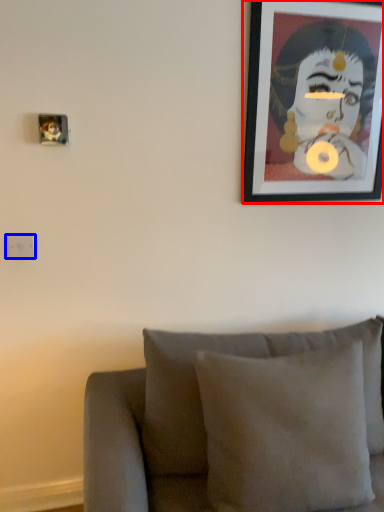
Question: Which point is further to the camera, picture frame (highlighted by a red box) or electric outlet (highlighted by a blue box)?

Choices:
 (A) picture frame
 (B) electric outlet

Answer: (B)